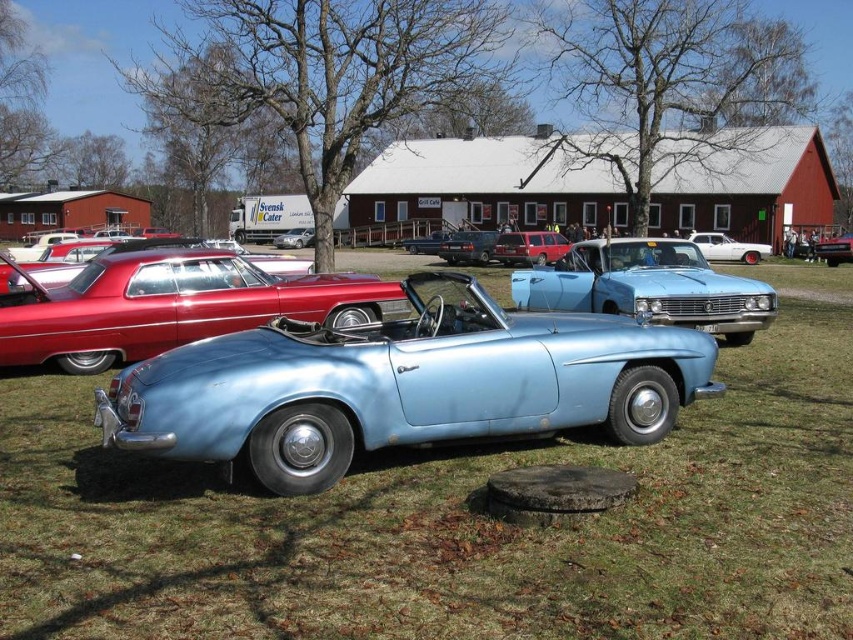
Is the position of matte red station wagon at center less distant than that of white glossy sedan at center?

Yes, matte red station wagon at center is closer to the viewer.

The width and height of the screenshot is (853, 640). I want to click on matte red station wagon at center, so click(x=529, y=248).

Does point (505, 244) lie behind point (691, 237)?

No, it is in front of (691, 237).

The height and width of the screenshot is (640, 853). I want to click on matte red station wagon at center, so click(x=529, y=248).

Between light blue metallic car at center and metallic blue convertible at center, which one appears on the left side from the viewer's perspective?

metallic blue convertible at center is more to the left.

Can you confirm if light blue metallic car at center is positioned to the left of metallic blue convertible at center?

Incorrect, light blue metallic car at center is not on the left side of metallic blue convertible at center.

Image resolution: width=853 pixels, height=640 pixels. Describe the element at coordinates (647, 285) in the screenshot. I see `light blue metallic car at center` at that location.

Locate an element on the screen. light blue metallic car at center is located at coordinates (647, 285).

Between matte red station wagon at center and metallic red car at right, which one has more height?

metallic red car at right

Does matte red station wagon at center appear over metallic red car at right?

No, matte red station wagon at center is not above metallic red car at right.

Identify the location of matte red station wagon at center. This screenshot has width=853, height=640. (529, 248).